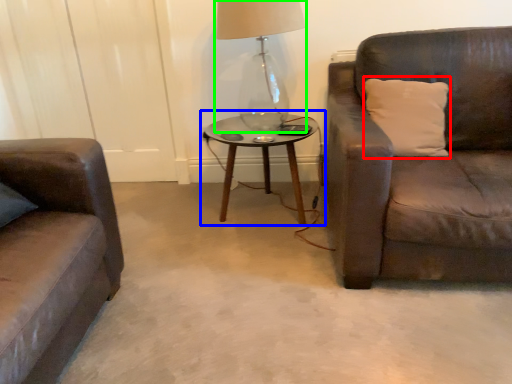
Question: Which object is positioned closest to pillow (highlighted by a red box)? Select from coffee table (highlighted by a blue box) and table lamp (highlighted by a green box).

Choices:
 (A) coffee table
 (B) table lamp

Answer: (A)